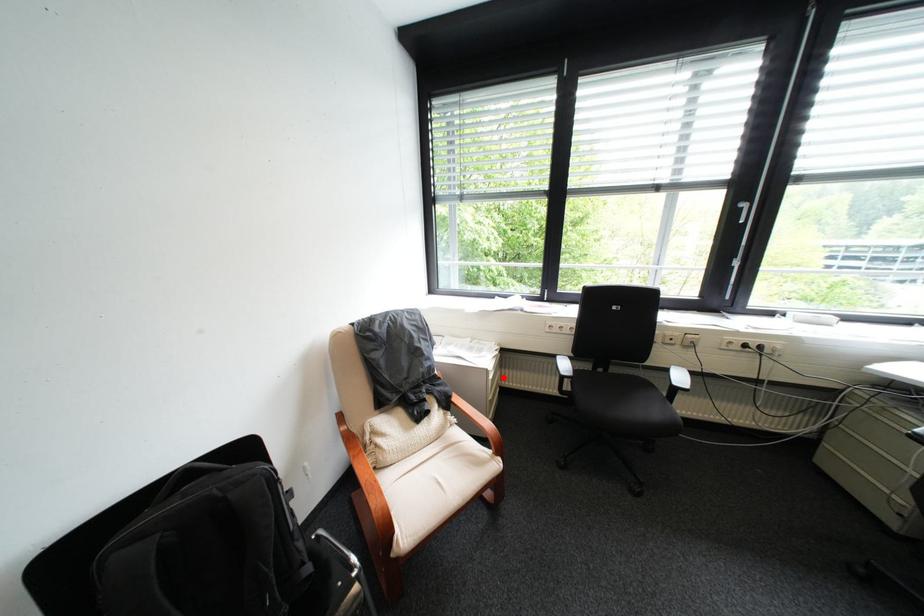
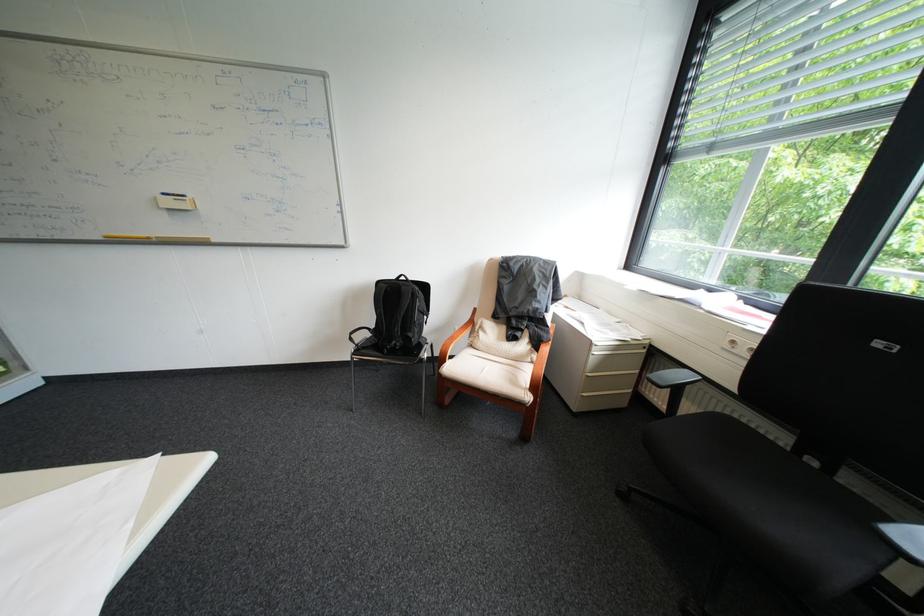
Locate, in the second image, the point that corresponds to the highlighted location in the first image.

(609, 353)